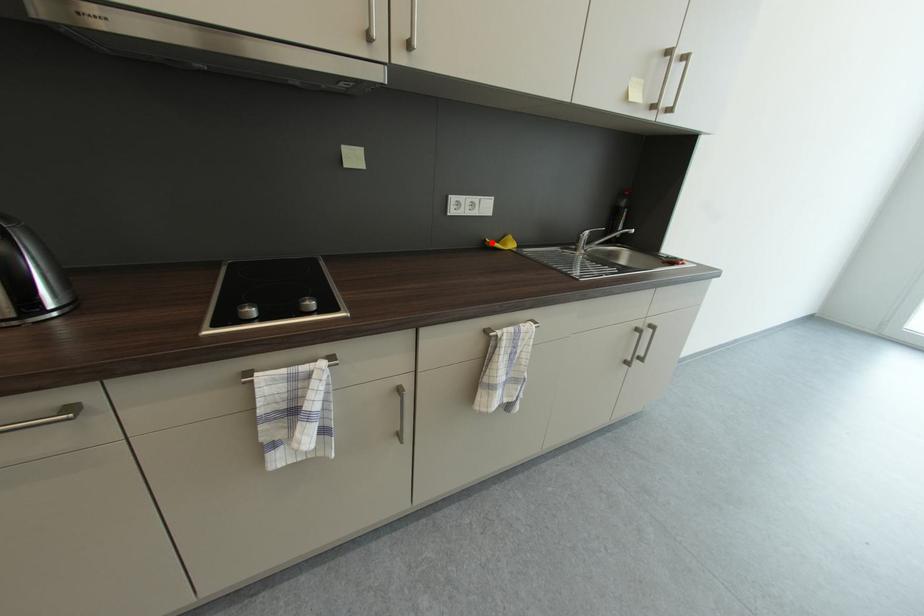
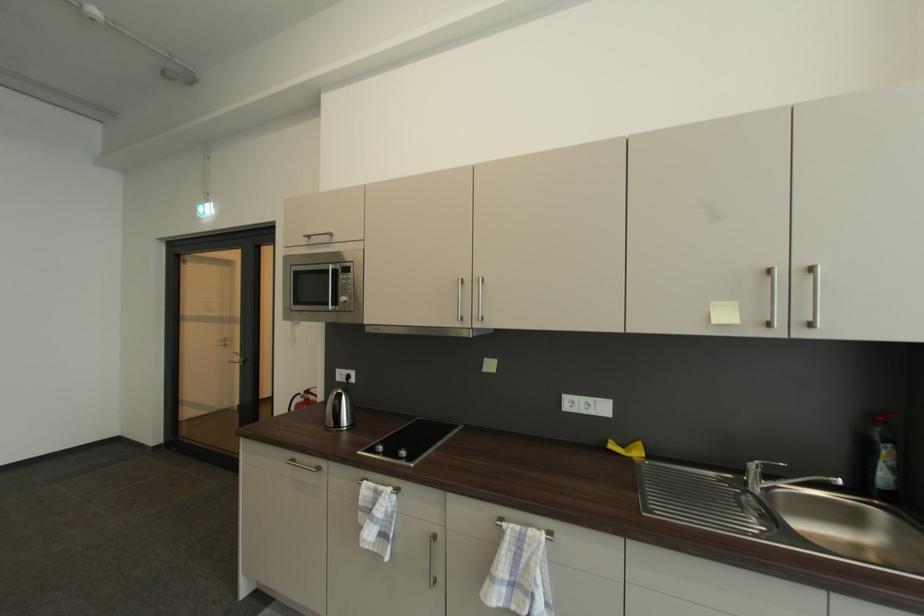
Find the pixel in the second image that matches the highlighted location in the first image.

(613, 443)